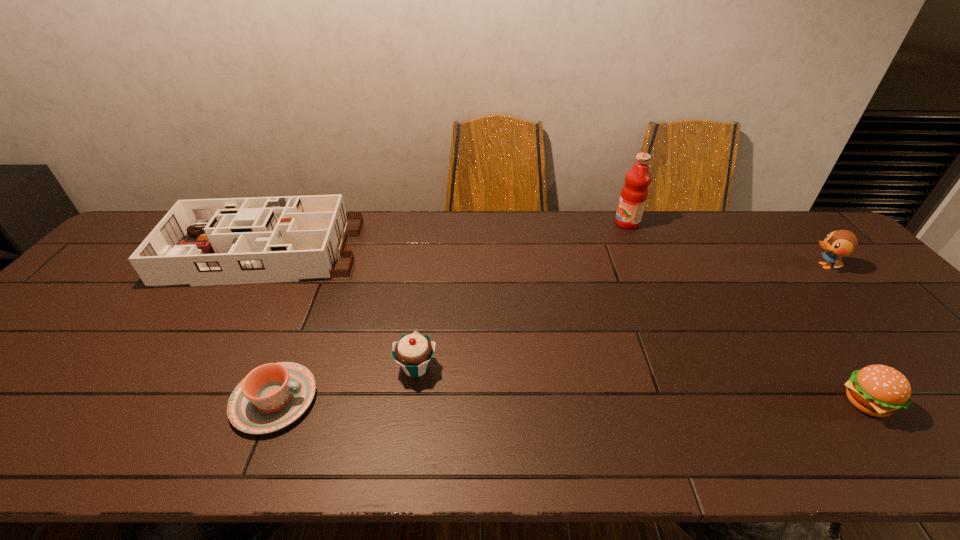
Where is `vacant point located between the rightmost object and the shortest object`? vacant point located between the rightmost object and the shortest object is located at coordinates (549, 333).

Image resolution: width=960 pixels, height=540 pixels. Identify the location of vacant point located between the shortest object and the hamburger. (570, 401).

Locate an element on the screen. The image size is (960, 540). free space between the third object from right to left and the chinaware is located at coordinates (450, 312).

At what (x,y) coordinates should I click in order to perform the action: click on free spot between the third object from right to left and the shortest object. Please return your answer as a coordinate pair (x, y). The height and width of the screenshot is (540, 960). Looking at the image, I should click on (450, 312).

At what (x,y) coordinates should I click in order to perform the action: click on free space between the rightmost object and the dollhouse. Please return your answer as a coordinate pair (x, y). The height and width of the screenshot is (540, 960). Looking at the image, I should click on (542, 259).

Image resolution: width=960 pixels, height=540 pixels. I want to click on vacant region between the fourth object from left to right and the shortest object, so click(450, 312).

Image resolution: width=960 pixels, height=540 pixels. Find the location of `free space between the chinaware and the fourth object from right to left`. free space between the chinaware and the fourth object from right to left is located at coordinates (346, 383).

Locate an element on the screen. This screenshot has width=960, height=540. vacant space in between the third object from right to left and the second object from right to left is located at coordinates (747, 313).

Identify the location of the fifth closest object to the shortest object. (839, 243).

The image size is (960, 540). Identify the location of object that is the fifth closest one to the fourth object from right to left. (839, 243).